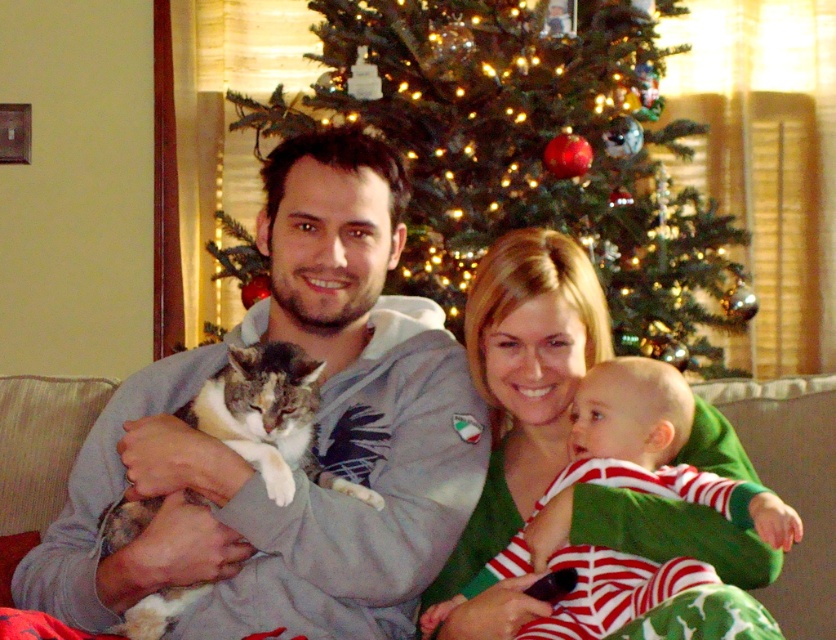
From the picture: Can you confirm if gray hoodie at center is wider than calico fur cat at center?

Correct, the width of gray hoodie at center exceeds that of calico fur cat at center.

Is point (447, 426) farther from camera compared to point (128, 618)?

That is True.

Identify the location of gray hoodie at center. (314, 436).

Does gray hoodie at center come in front of green textured christmas tree at center?

Yes, it is in front of green textured christmas tree at center.

You are a GUI agent. You are given a task and a screenshot of the screen. Output one action in this format:
    pyautogui.click(x=<x>, y=<y>)
    Task: Click on the gray hoodie at center
    The height and width of the screenshot is (640, 836).
    Given the screenshot: What is the action you would take?
    pyautogui.click(x=314, y=436)

Is point (283, 266) positioned in front of point (434, 621)?

No, it is not.

Which is in front, point (292, 528) or point (681, 576)?

Point (681, 576) is in front.

This screenshot has height=640, width=836. What are the coordinates of `gray hoodie at center` in the screenshot? It's located at (314, 436).